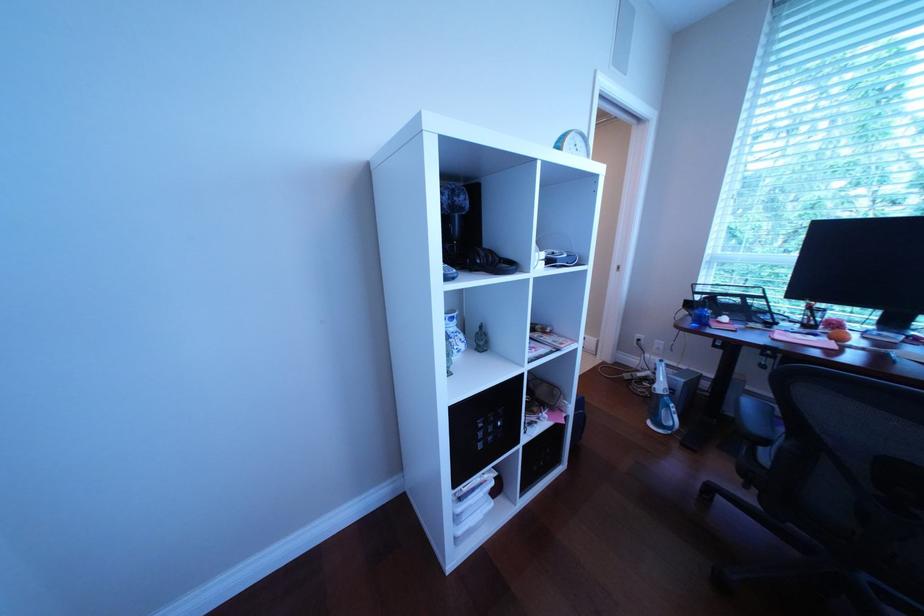
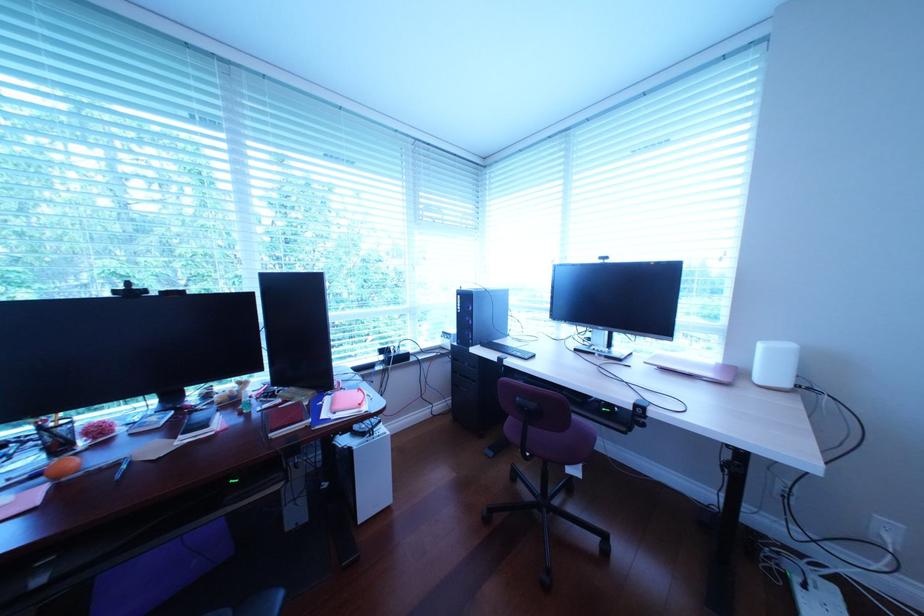
Question: The images are taken continuously from a first-person perspective. In which direction is your viewpoint rotating?

Choices:
 (A) Left
 (B) Right
 (C) Up
 (D) Down

Answer: (B)